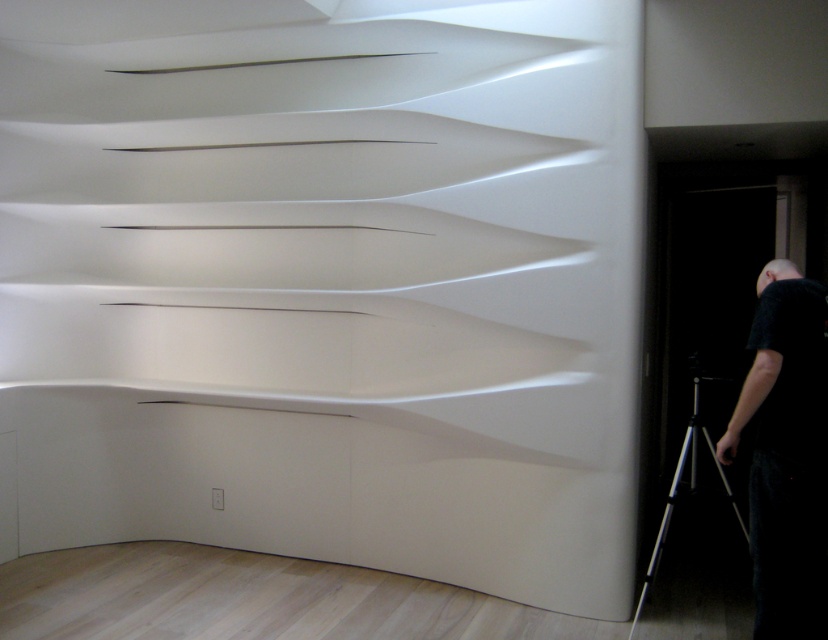
Which of these two, black matte person at lower right or silver metallic tripod at lower right, stands shorter?

silver metallic tripod at lower right is shorter.

Who is taller, black matte person at lower right or silver metallic tripod at lower right?

black matte person at lower right

Does point (745, 404) lie behind point (692, 474)?

That is False.

Locate an element on the screen. black matte person at lower right is located at coordinates (786, 451).